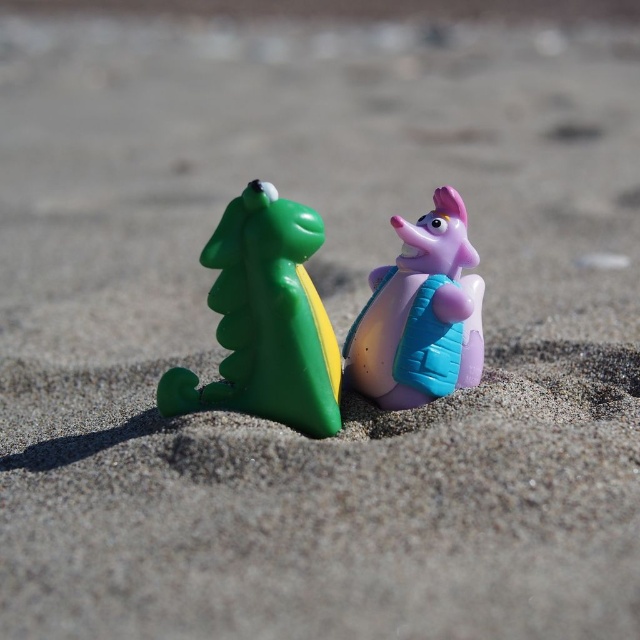
Question: Which of the following is the farthest from the observer?

Choices:
 (A) (397, 364)
 (B) (275, 376)

Answer: (A)

Question: Can you confirm if green plastic dinosaur at left is positioned below glossy plastic snail at center?

Choices:
 (A) no
 (B) yes

Answer: (B)

Question: Is green plastic dinosaur at left above glossy plastic snail at center?

Choices:
 (A) yes
 (B) no

Answer: (B)

Question: Which object appears closest to the camera in this image?

Choices:
 (A) glossy plastic snail at center
 (B) green plastic dinosaur at left

Answer: (B)

Question: From the image, what is the correct spatial relationship of green plastic dinosaur at left in relation to glossy plastic snail at center?

Choices:
 (A) above
 (B) below

Answer: (B)

Question: Which object appears farthest from the camera in this image?

Choices:
 (A) glossy plastic snail at center
 (B) green plastic dinosaur at left

Answer: (A)